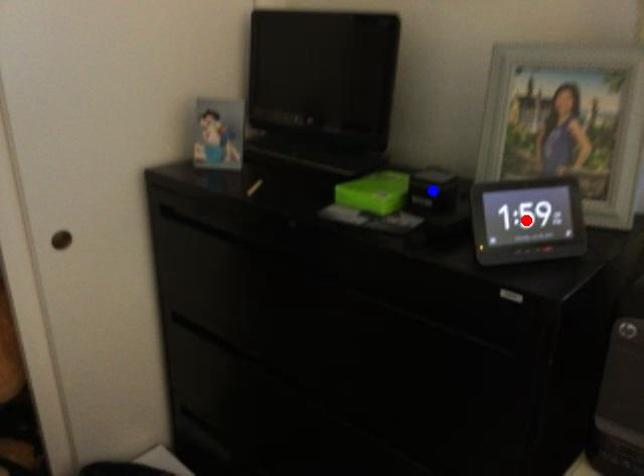
Question: Which of the two points in the image is closer to the camera?

Choices:
 (A) Blue point is closer.
 (B) Red point is closer.

Answer: (B)